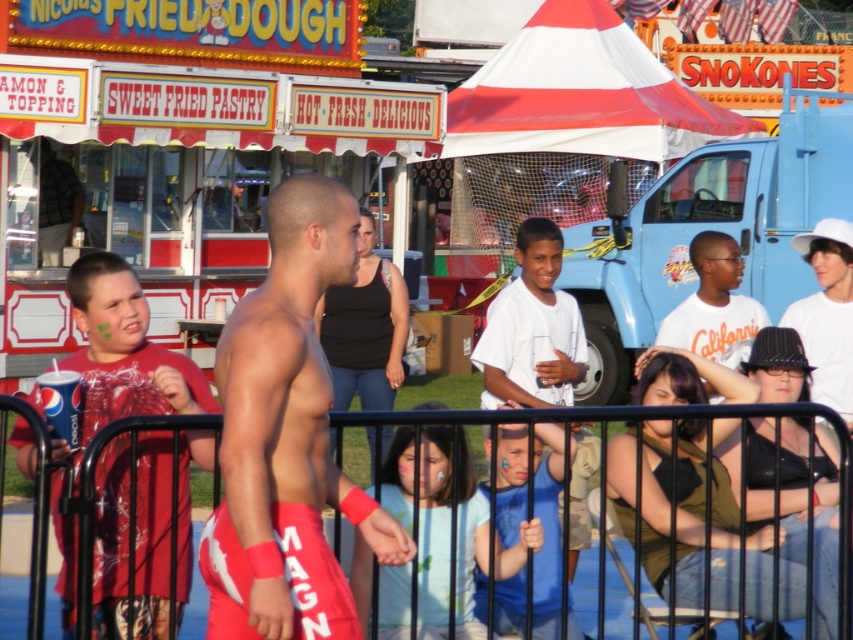
You are a photographer at the carnival trying to capture a photo of the matte red shirt at left and the white matte shirt at center. Which shirt should you focus on first if you want to include both in your frame without moving the camera?

The matte red shirt at left is positioned on the left side of the white matte shirt at center, so you should focus on the white matte shirt at center first to ensure both shirts are in the frame without moving the camera.